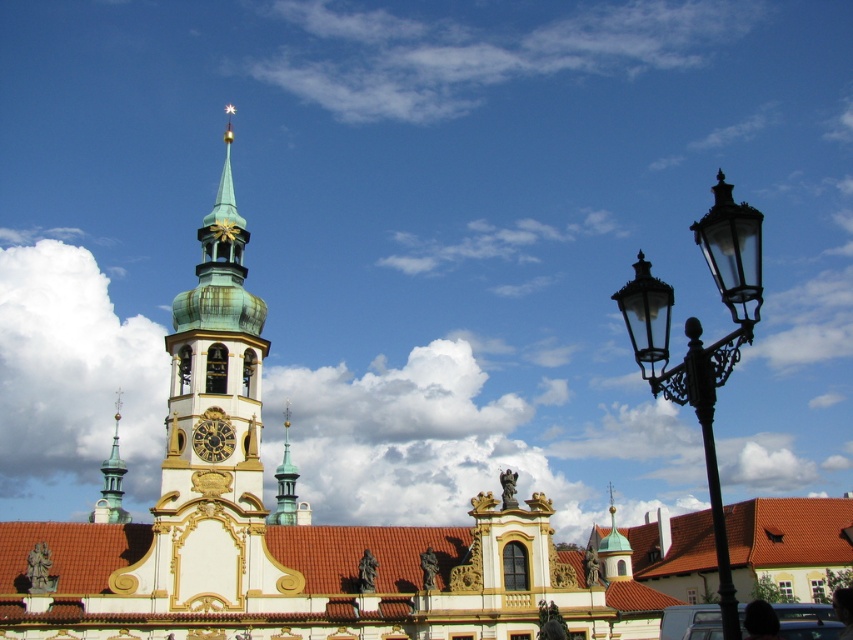
Based on the scene description, what object is located at the coordinates point (288, 525)?

The gold ornate church at center is located at point (288, 525).

You are standing at the base of the historic building and want to take a photo of the point labeled as point (189, 404). If your camera has a maximum zoom range of 100 meters, will you be able to capture that point clearly in your photo?

→ The distance between point (189, 404) and the camera is 86.86 meters, which is within the camera maximum zoom range of 100 meters. Therefore, you can capture the point clearly.

You are standing in front of the historic building and want to take a photo that includes both the gold ornate church at center and the green polished stone spire at center. Based on their positions, which object should you position closer to the left side of the frame?

The green polished stone spire at center should be positioned closer to the left side of the frame because the gold ornate church at center is to the right of it.